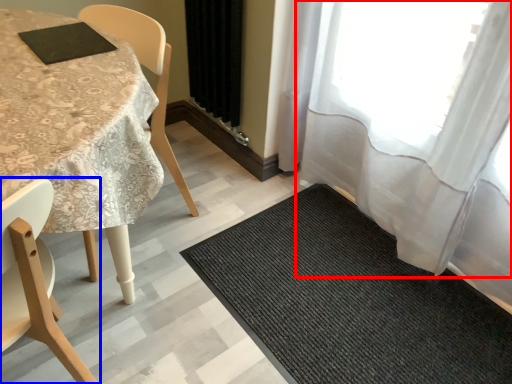
Question: Which point is further to the camera, curtain (highlighted by a red box) or chair (highlighted by a blue box)?

Choices:
 (A) curtain
 (B) chair

Answer: (A)